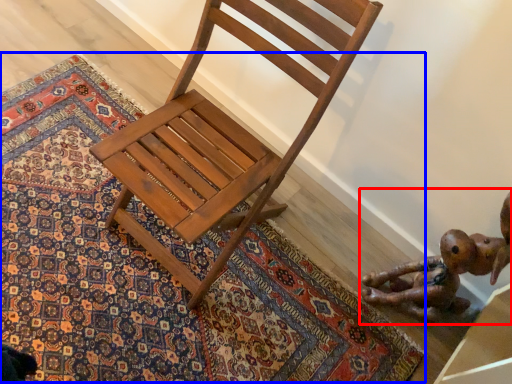
Question: Which object appears closest to the camera in this image, toy (highlighted by a red box) or mat (highlighted by a blue box)?

Choices:
 (A) toy
 (B) mat

Answer: (A)